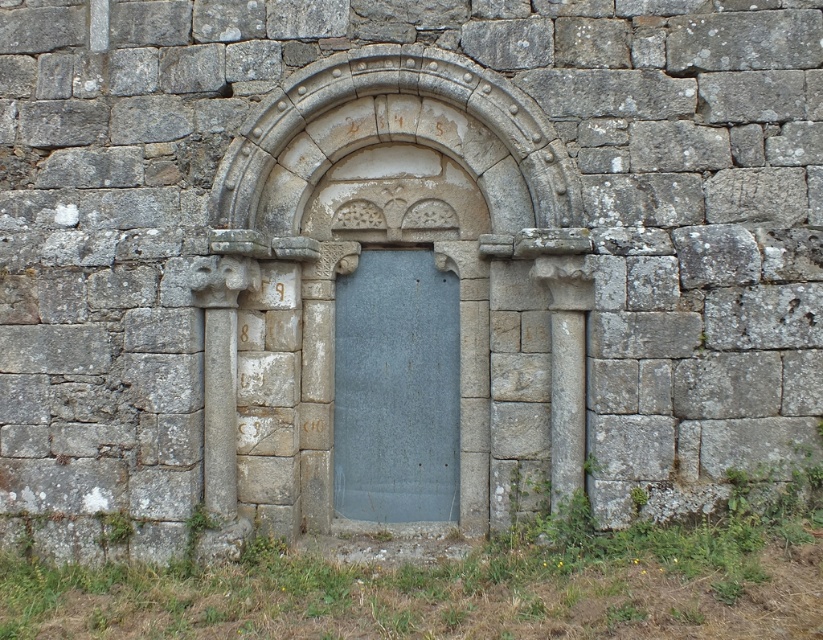
Between stone archway at center and blue stone door at center, which one is positioned higher?

stone archway at center

Does stone archway at center have a lesser width compared to blue stone door at center?

No.

Between point (566, 349) and point (453, 394), which one is positioned behind?

The point (453, 394) is behind.

Locate an element on the screen. Image resolution: width=823 pixels, height=640 pixels. stone archway at center is located at coordinates (393, 243).